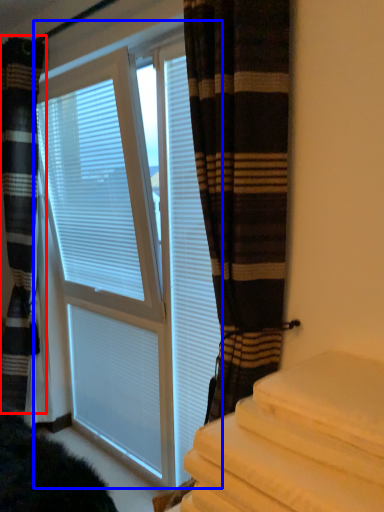
Question: Which object appears closest to the camera in this image, curtain (highlighted by a red box) or bay window (highlighted by a blue box)?

Choices:
 (A) curtain
 (B) bay window

Answer: (B)